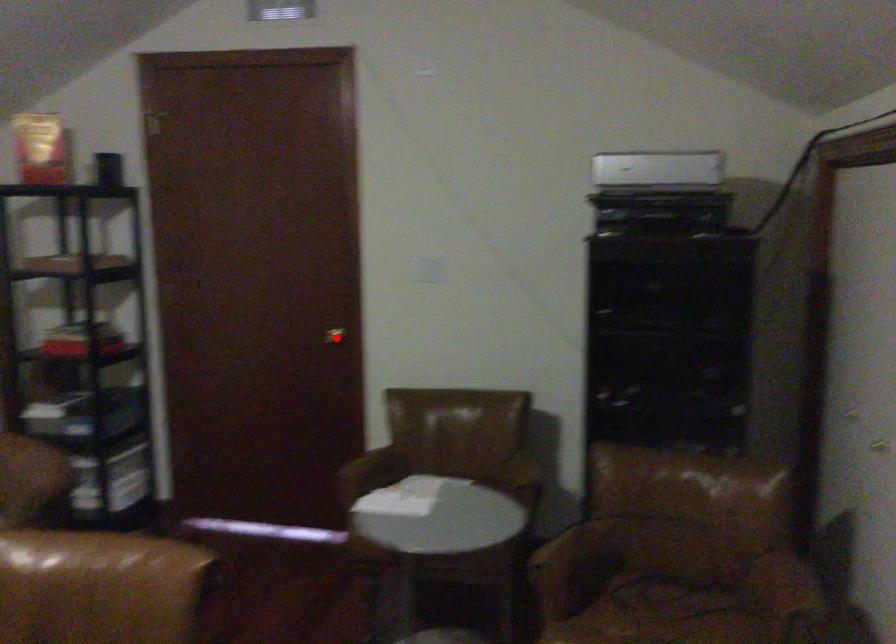
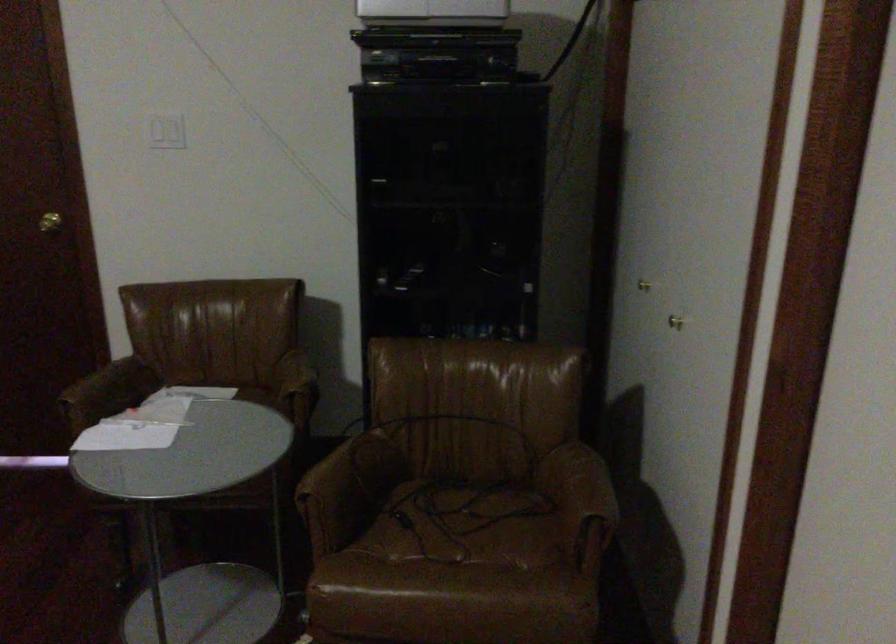
The point at the highlighted location is marked in the first image. Where is the corresponding point in the second image?

(49, 222)